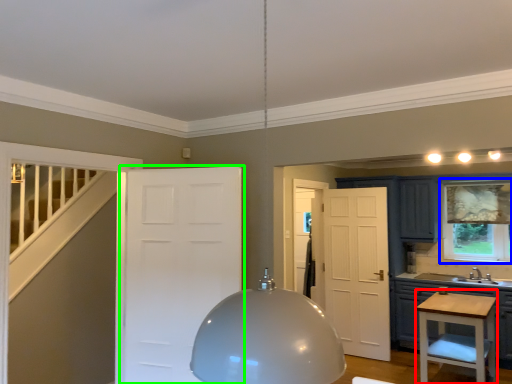
Question: Which object is positioned closest to vanity (highlighted by a red box)? Select from window (highlighted by a blue box) and door (highlighted by a green box).

Choices:
 (A) window
 (B) door

Answer: (A)